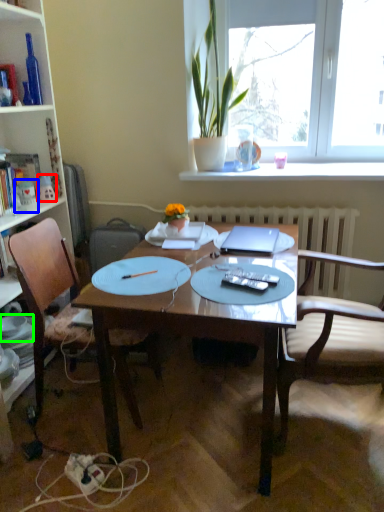
Question: Which object is positioned closest to toy (highlighted by a red box)? Select from toy (highlighted by a blue box) and tableware (highlighted by a green box).

Choices:
 (A) toy
 (B) tableware

Answer: (A)